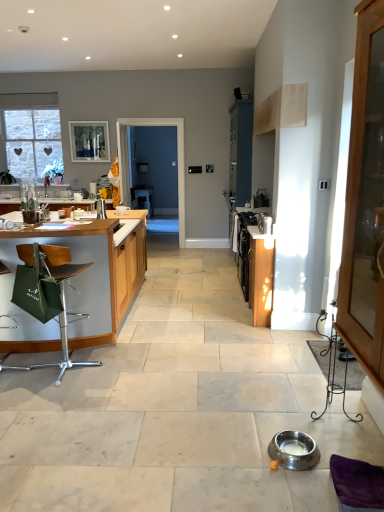
The width and height of the screenshot is (384, 512). Identify the location of vacant area that lies between stainless steel bowl at lower center, positioned as the first appliance in front-to-back order, and wooden cabinet at right, the second cabinetry when ordered from front to back. (272, 372).